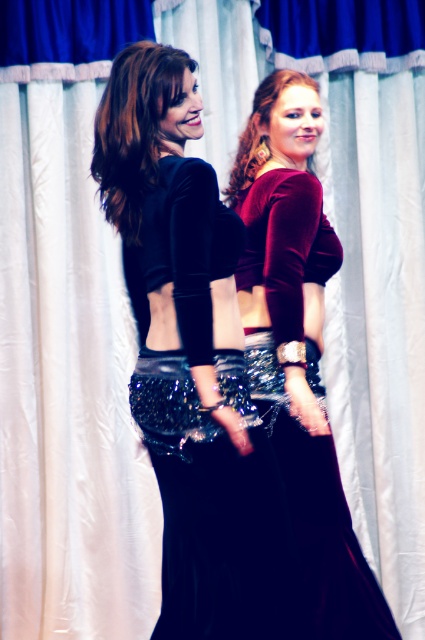
In the scene shown: Does velvet black dress at center appear over velvet maroon crop top at center?

Yes.

This screenshot has height=640, width=425. Find the location of `velvet black dress at center`. velvet black dress at center is located at coordinates (189, 355).

Which is behind, point (192, 88) or point (302, 488)?

The point (302, 488) is more distant.

Find the location of `velvet black dress at center`. velvet black dress at center is located at coordinates click(x=189, y=355).